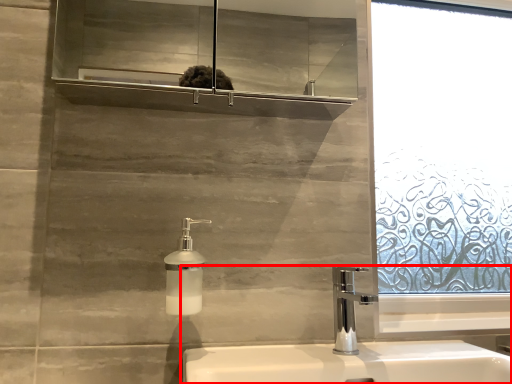
Question: From the image's perspective, considering the relative positions of sink (annotated by the red box) and soap dispenser in the image provided, where is sink (annotated by the red box) located with respect to the staircase?

Choices:
 (A) below
 (B) above

Answer: (A)